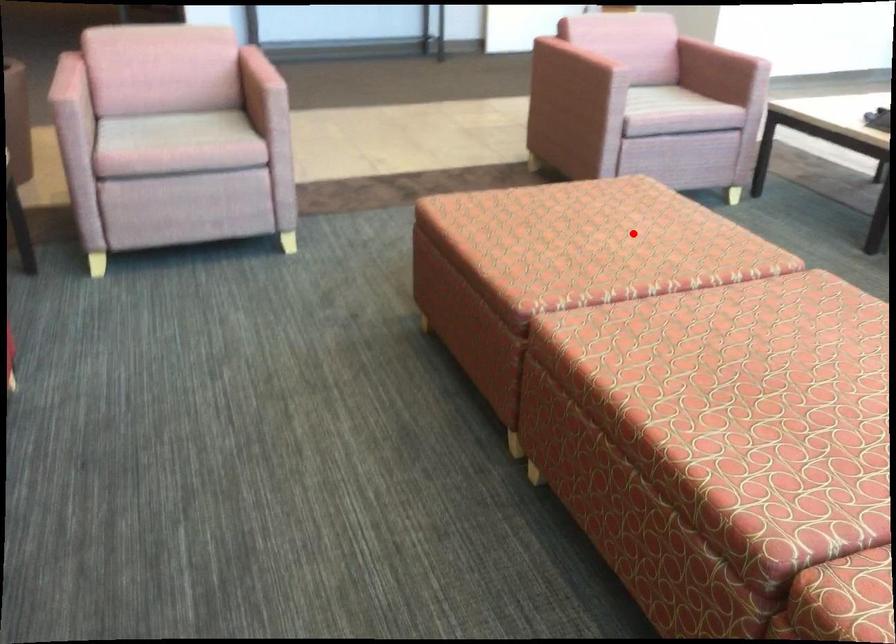
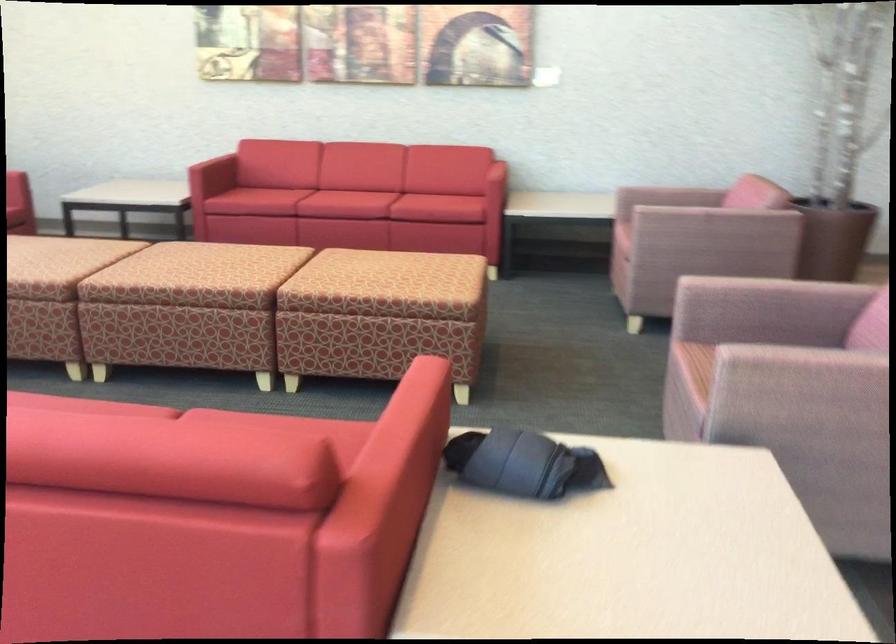
Question: A red point is marked in image1. In image2, is the corresponding 3D point closer to the camera or farther? Reply with the corresponding letter.

Choices:
 (A) The corresponding 3D point is closer.
 (B) The corresponding 3D point is farther.

Answer: (B)